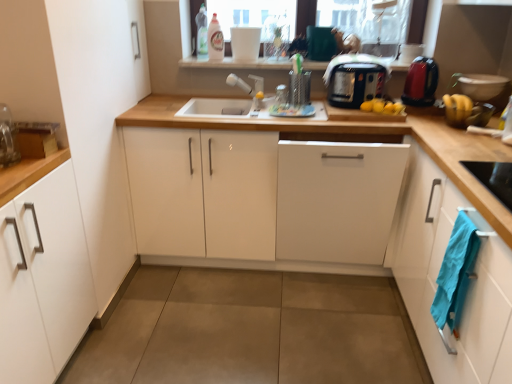
Question: Can you confirm if white glossy cabinet at center, the third cabinetry when ordered from right to left, is thinner than white matte cabinet at left, marked as the 1th cabinetry in a left-to-right arrangement?

Choices:
 (A) yes
 (B) no

Answer: (B)

Question: Is white glossy cabinet at center, the third cabinetry when ordered from right to left, located outside white matte cabinet at left, the fourth cabinetry in the right-to-left sequence?

Choices:
 (A) no
 (B) yes

Answer: (B)

Question: Can you confirm if white glossy cabinet at center, the third cabinetry when ordered from right to left, is taller than white matte cabinet at left, marked as the 1th cabinetry in a left-to-right arrangement?

Choices:
 (A) no
 (B) yes

Answer: (A)

Question: Does white glossy cabinet at center, the third cabinetry when ordered from right to left, come behind white matte cabinet at left, marked as the 1th cabinetry in a left-to-right arrangement?

Choices:
 (A) no
 (B) yes

Answer: (B)

Question: Would you say white glossy cabinet at center, the third cabinetry when ordered from right to left, is a long distance from white matte cabinet at left, marked as the 1th cabinetry in a left-to-right arrangement?

Choices:
 (A) no
 (B) yes

Answer: (A)

Question: Do you think white matte cabinet at left, the fourth cabinetry in the right-to-left sequence, is within black plastic toaster at upper center, which is the second appliance from right to left, or outside of it?

Choices:
 (A) outside
 (B) inside

Answer: (A)

Question: In the image, is white matte cabinet at left, marked as the 1th cabinetry in a left-to-right arrangement, on the left side or the right side of black plastic toaster at upper center, which is the second appliance from right to left?

Choices:
 (A) right
 (B) left

Answer: (B)

Question: Is white matte cabinet at left, marked as the 1th cabinetry in a left-to-right arrangement, wider or thinner than black plastic toaster at upper center, which is the second appliance from right to left?

Choices:
 (A) wide
 (B) thin

Answer: (A)

Question: From a real-world perspective, is white matte cabinet at left, the fourth cabinetry in the right-to-left sequence, physically located above or below black plastic toaster at upper center, which is the second appliance from right to left?

Choices:
 (A) above
 (B) below

Answer: (B)

Question: From the image's perspective, is blue cotton towel at lower right above or below white matte cabinet at left, the fourth cabinetry in the right-to-left sequence?

Choices:
 (A) below
 (B) above

Answer: (B)

Question: Looking at their shapes, would you say blue cotton towel at lower right is wider or thinner than white matte cabinet at left, marked as the 1th cabinetry in a left-to-right arrangement?

Choices:
 (A) wide
 (B) thin

Answer: (B)

Question: From a real-world perspective, is blue cotton towel at lower right physically located above or below white matte cabinet at left, marked as the 1th cabinetry in a left-to-right arrangement?

Choices:
 (A) above
 (B) below

Answer: (A)

Question: Is blue cotton towel at lower right to the left or to the right of white matte cabinet at left, marked as the 1th cabinetry in a left-to-right arrangement, in the image?

Choices:
 (A) left
 (B) right

Answer: (B)

Question: Is white matte faucet at center bigger or smaller than blue cotton towel at lower right?

Choices:
 (A) big
 (B) small

Answer: (A)

Question: From their relative heights in the image, would you say white matte faucet at center is taller or shorter than blue cotton towel at lower right?

Choices:
 (A) tall
 (B) short

Answer: (B)